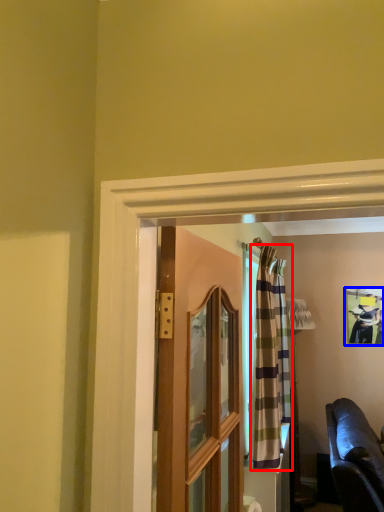
Question: Among these objects, which one is nearest to the camera, curtain (highlighted by a red box) or picture frame (highlighted by a blue box)?

Choices:
 (A) curtain
 (B) picture frame

Answer: (A)